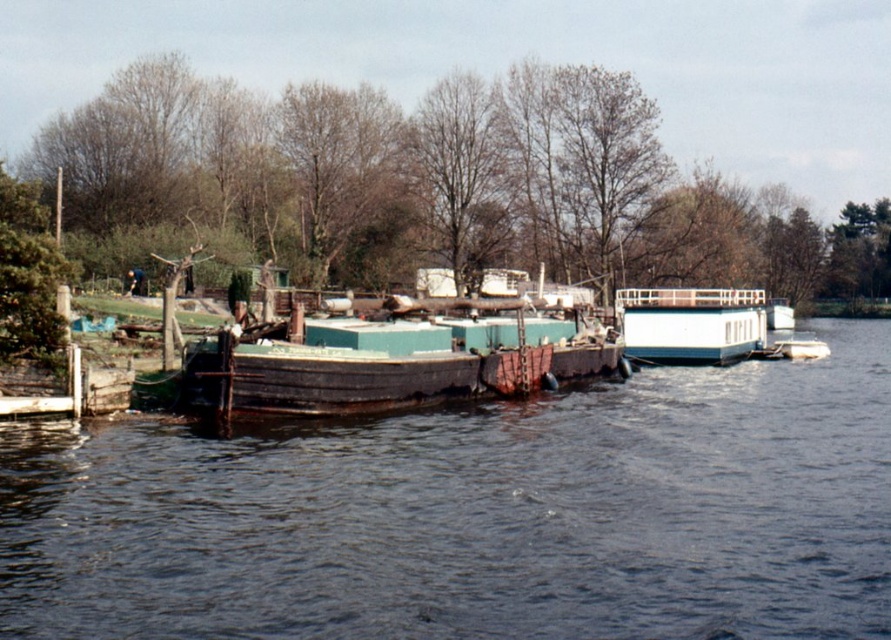
Based on the photo, you are standing on the larger turquoise houseboat with a flat roof and want to reach the point marked at coordinates (476,515). Based on the scene description, is this point located on water or land?

The point at coordinates (476,515) is on dark brown water at center, so it is located on water.

You are standing on the riverbank and see the dark brown water at center and the white glossy houseboat at center. Which object is located below the other?

The dark brown water at center is positioned under the white glossy houseboat at center, so the water is below the houseboat.